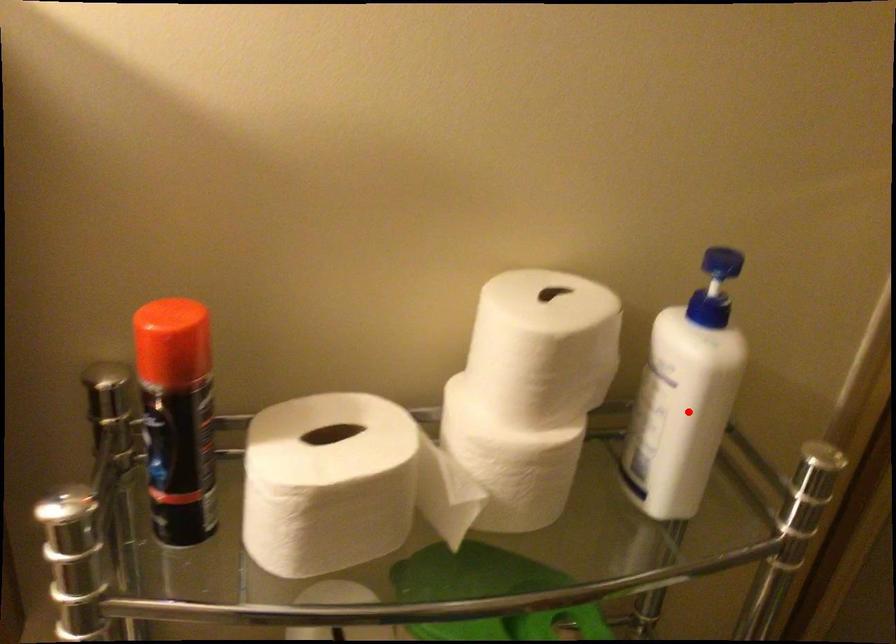
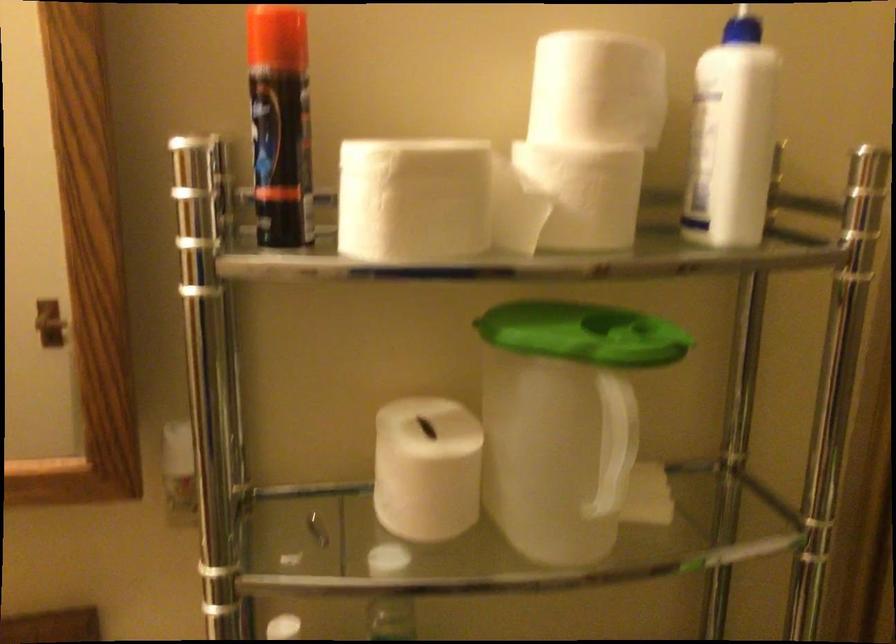
The point at the highlighted location is marked in the first image. Where is the corresponding point in the second image?

(731, 137)